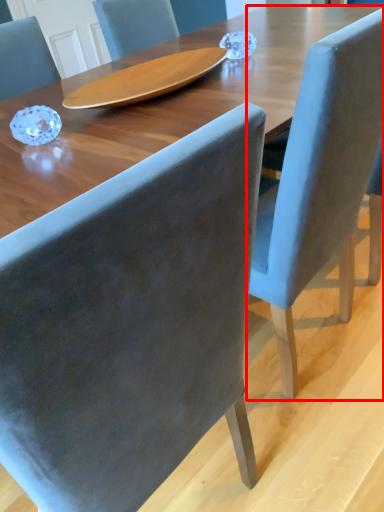
Question: Observing the image, what is the correct spatial positioning of chair (annotated by the red box) in reference to chair?

Choices:
 (A) left
 (B) right

Answer: (B)